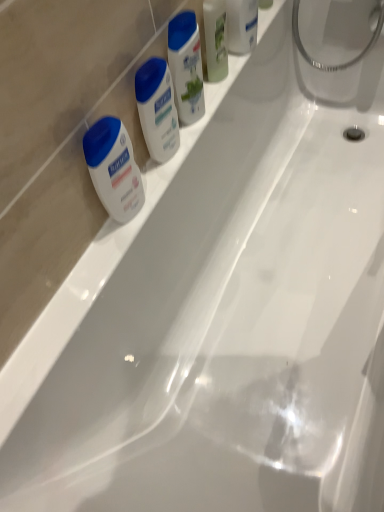
Question: From the image's perspective, is white matte lotion at center, the 1th toiletry positioned from the bottom, over green matte mouthwash at upper center?

Choices:
 (A) no
 (B) yes

Answer: (A)

Question: Is white matte lotion at center, the 1th toiletry positioned from the bottom, positioned behind green matte mouthwash at upper center?

Choices:
 (A) no
 (B) yes

Answer: (A)

Question: From a real-world perspective, is white matte lotion at center, the 4th toiletry viewed from the top, under green matte mouthwash at upper center?

Choices:
 (A) no
 (B) yes

Answer: (B)

Question: Is white matte lotion at center, the 4th toiletry viewed from the top, facing towards green matte mouthwash at upper center?

Choices:
 (A) yes
 (B) no

Answer: (B)

Question: Does white matte lotion at center, the 1th toiletry positioned from the bottom, come in front of green matte mouthwash at upper center?

Choices:
 (A) yes
 (B) no

Answer: (A)

Question: Relative to white matte lotion at center, the 4th toiletry viewed from the top, is white glossy lotion at upper center, positioned as the third toiletry in bottom-to-top order, in front or behind?

Choices:
 (A) front
 (B) behind

Answer: (B)

Question: Would you say white glossy lotion at upper center, positioned as the third toiletry in bottom-to-top order, is to the left or to the right of white matte lotion at center, the 1th toiletry positioned from the bottom, in the picture?

Choices:
 (A) right
 (B) left

Answer: (A)

Question: From the image's perspective, is white glossy lotion at upper center, positioned as the third toiletry in bottom-to-top order, positioned above or below white matte lotion at center, the 1th toiletry positioned from the bottom?

Choices:
 (A) above
 (B) below

Answer: (A)

Question: In terms of width, does white glossy lotion at upper center, acting as the 2th toiletry starting from the top, look wider or thinner when compared to white matte lotion at center, the 1th toiletry positioned from the bottom?

Choices:
 (A) thin
 (B) wide

Answer: (B)

Question: From the image's perspective, is white glossy lotion at upper center, positioned as the third toiletry in bottom-to-top order, positioned above or below white glossy lotion at upper center, the third toiletry from the top?

Choices:
 (A) above
 (B) below

Answer: (A)

Question: Is white glossy lotion at upper center, acting as the 2th toiletry starting from the top, bigger or smaller than white glossy lotion at upper center, which appears as the second toiletry when ordered from the bottom?

Choices:
 (A) small
 (B) big

Answer: (B)

Question: Considering the relative positions of white glossy lotion at upper center, positioned as the third toiletry in bottom-to-top order, and white glossy lotion at upper center, which appears as the second toiletry when ordered from the bottom, in the image provided, is white glossy lotion at upper center, positioned as the third toiletry in bottom-to-top order, to the left or to the right of white glossy lotion at upper center, which appears as the second toiletry when ordered from the bottom,?

Choices:
 (A) right
 (B) left

Answer: (A)

Question: From a real-world perspective, is white glossy lotion at upper center, acting as the 2th toiletry starting from the top, above or below white glossy lotion at upper center, which appears as the second toiletry when ordered from the bottom?

Choices:
 (A) below
 (B) above

Answer: (B)

Question: Is white matte lotion at left in front of or behind translucent plastic soap at upper right, which appears as the fourth toiletry when ordered from the bottom, in the image?

Choices:
 (A) behind
 (B) front

Answer: (B)

Question: Considering the positions of point (119, 125) and point (263, 1), is point (119, 125) closer or farther from the camera than point (263, 1)?

Choices:
 (A) farther
 (B) closer

Answer: (B)